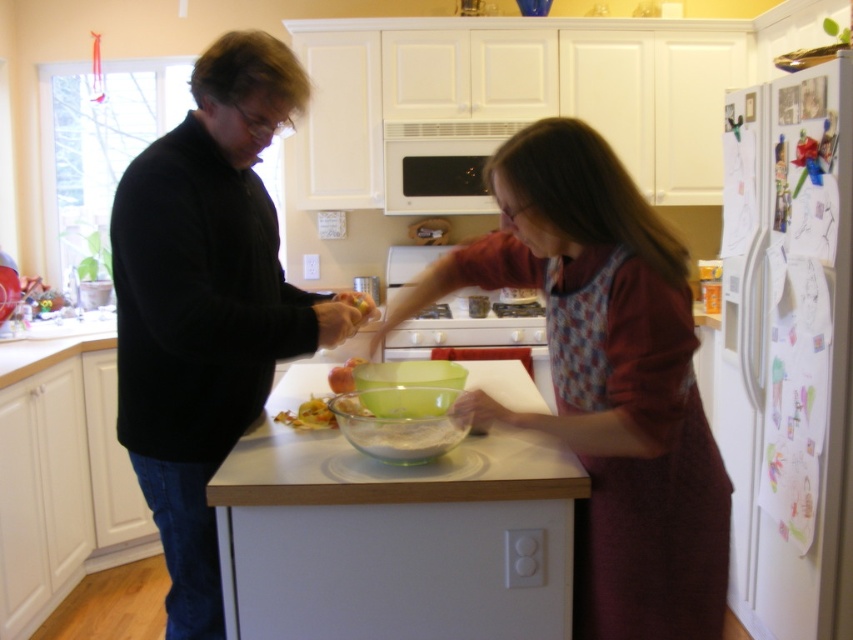
Who is positioned more to the right, clear glass bowl at center or yellowish matte shredded food at center?

From the viewer's perspective, clear glass bowl at center appears more on the right side.

Can you confirm if clear glass bowl at center is bigger than yellowish matte shredded food at center?

Yes, clear glass bowl at center is bigger than yellowish matte shredded food at center.

You are a GUI agent. You are given a task and a screenshot of the screen. Output one action in this format:
    pyautogui.click(x=<x>, y=<y>)
    Task: Click on the clear glass bowl at center
    The width and height of the screenshot is (853, 640).
    Given the screenshot: What is the action you would take?
    pyautogui.click(x=608, y=381)

Locate an element on the screen. clear glass bowl at center is located at coordinates (608, 381).

Is matte red dress at center above translucent plastic bag at center?

Actually, matte red dress at center is below translucent plastic bag at center.

Locate an element on the screen. This screenshot has width=853, height=640. matte red dress at center is located at coordinates (606, 380).

This screenshot has width=853, height=640. I want to click on matte red dress at center, so click(606, 380).

You are a GUI agent. You are given a task and a screenshot of the screen. Output one action in this format:
    pyautogui.click(x=<x>, y=<y>)
    Task: Click on the matte red dress at center
    The width and height of the screenshot is (853, 640).
    Given the screenshot: What is the action you would take?
    pyautogui.click(x=606, y=380)

Can you confirm if yellowish matte shredded food at center is bigger than translucent plastic bag at center?

No, yellowish matte shredded food at center is not bigger than translucent plastic bag at center.

Can you confirm if yellowish matte shredded food at center is shorter than translucent plastic bag at center?

Correct, yellowish matte shredded food at center is not as tall as translucent plastic bag at center.

Between point (289, 417) and point (341, 378), which one is positioned in front?

Point (289, 417)

Identify the location of yellowish matte shredded food at center. Image resolution: width=853 pixels, height=640 pixels. (308, 416).